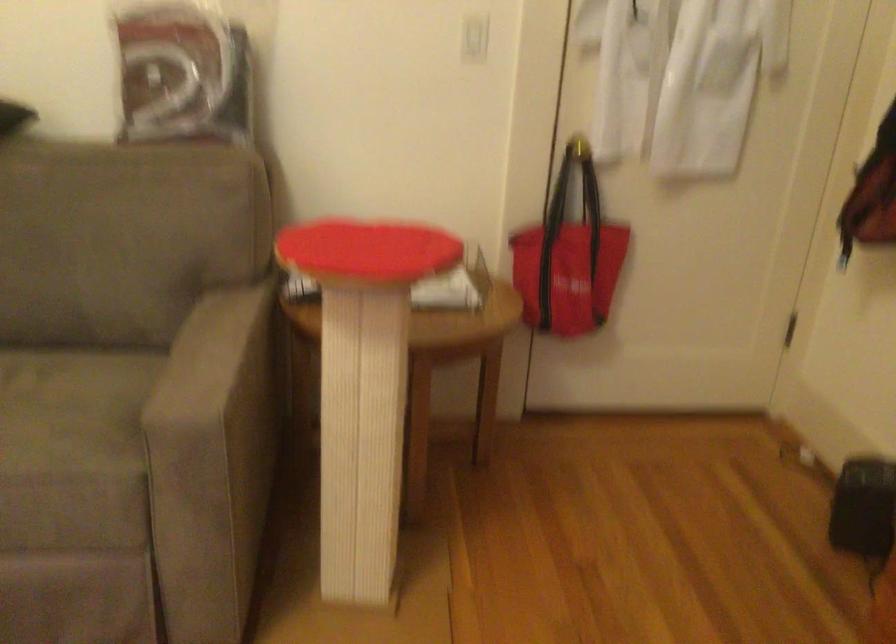
What do you see at coordinates (550, 245) in the screenshot?
I see `the black bag strap` at bounding box center [550, 245].